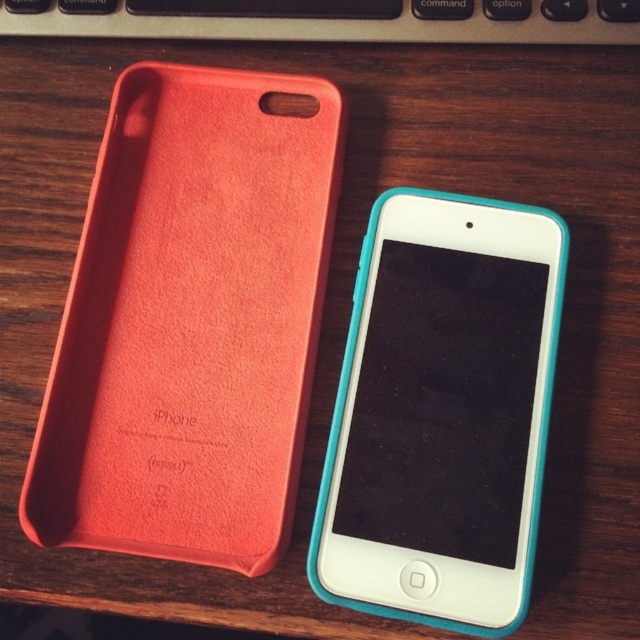
You are organizing a desk and need to place the teal rubberized smartphone at center and the black plastic keyboard at upper center. The desk has a 40 cm wide shelf. Can both items fit side by side on the shelf without overlapping?

The distance between the teal rubberized smartphone at center and the black plastic keyboard at upper center is 41.20 centimeters. Since the shelf is only 40 cm wide, the combined width of both items would exceed the shelf space, making it impossible to fit them side by side without overlapping.

You are positioning a teal rubberized smartphone at center on a wooden desk. If you need to place a new object at coordinate point 0.647, 0.691, will it overlap with the smartphone?

The teal rubberized smartphone at center is already located at point (442, 413), so placing another object at that coordinate would cause an overlap.